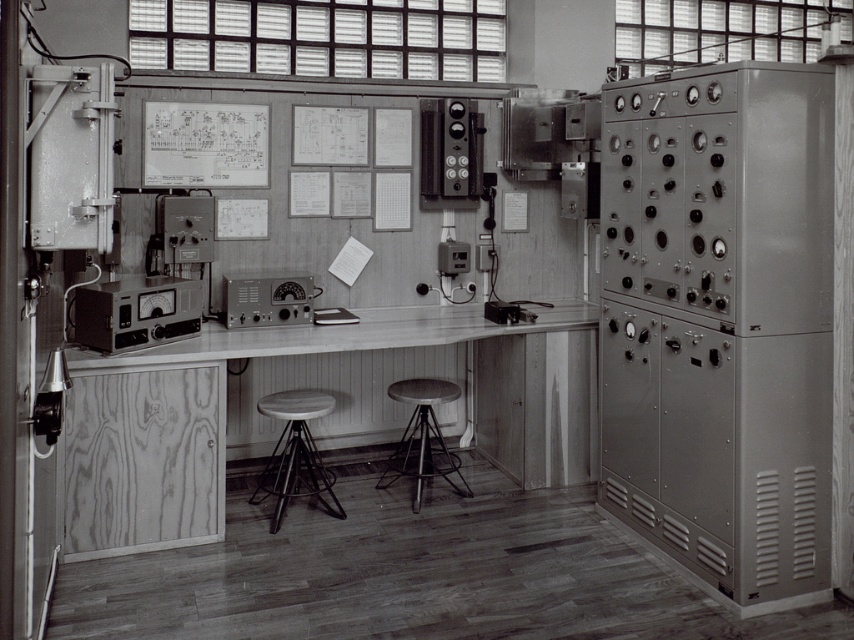
Question: Is smooth wood table at center to the left of wooden seat stool at center from the viewer's perspective?

Choices:
 (A) no
 (B) yes

Answer: (A)

Question: Which point is closer to the camera taking this photo?

Choices:
 (A) (253, 161)
 (B) (525, 387)
 (C) (297, 492)

Answer: (C)

Question: Does metallic panel meter at center have a smaller size compared to wooden seat stool at center?

Choices:
 (A) no
 (B) yes

Answer: (B)

Question: Does wooden seat stool at center appear over metallic silver radio at center?

Choices:
 (A) no
 (B) yes

Answer: (A)

Question: Which object is positioned closest to the metallic panel at right?

Choices:
 (A) metallic panel meter at center
 (B) metallic silver radio at center
 (C) smooth wood table at center
 (D) metallic stool at center

Answer: (C)

Question: Which object is positioned farthest from the metallic panel meter at center?

Choices:
 (A) metallic panel at right
 (B) smooth wood table at center
 (C) metallic silver radio at center
 (D) paperboard schematic at upper center

Answer: (A)